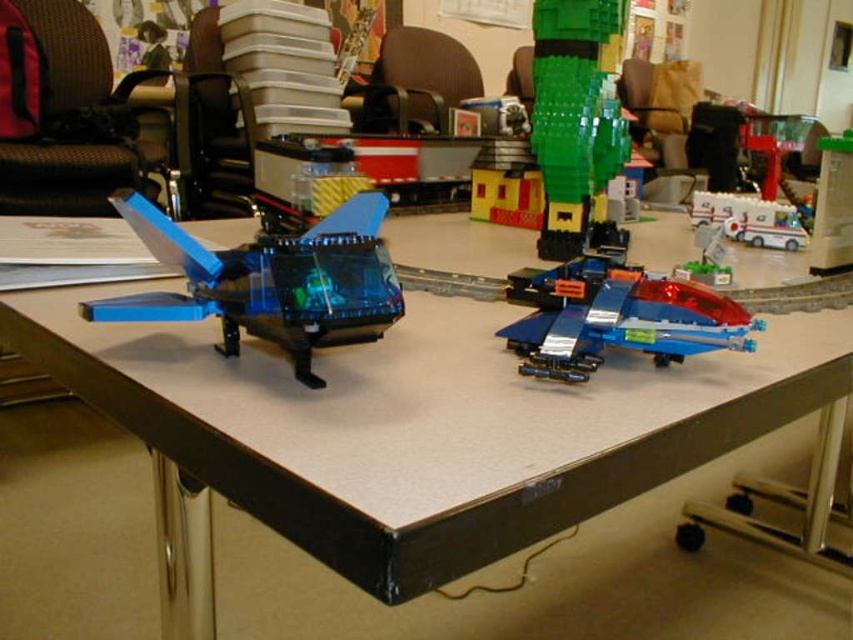
Consider the image. Does smooth gray table at center appear on the left side of translucent blue plastic spaceship at center?

Correct, you'll find smooth gray table at center to the left of translucent blue plastic spaceship at center.

Which of these two, smooth gray table at center or translucent blue plastic spaceship at center, stands taller?

With more height is smooth gray table at center.

Does point (622, 438) lie behind point (550, 352)?

No.

Locate an element on the screen. This screenshot has width=853, height=640. smooth gray table at center is located at coordinates (422, 424).

Between point (518, 344) and point (772, 241), which one is positioned in front?

Positioned in front is point (518, 344).

Is translucent blue plastic spaceship at center in front of white plastic ambulance at center-right?

Yes, translucent blue plastic spaceship at center is in front of white plastic ambulance at center-right.

Who is more distant from viewer, (558, 272) or (711, 212)?

Point (711, 212)

Locate an element on the screen. The width and height of the screenshot is (853, 640). translucent blue plastic spaceship at center is located at coordinates tap(616, 317).

Between transparent plastic spaceship at left and translucent blue plastic spaceship at center, which one has more height?

transparent plastic spaceship at left is taller.

Which is in front, point (215, 275) or point (579, 308)?

Point (215, 275) is more forward.

Which is behind, point (131, 209) or point (699, 292)?

The point (699, 292) is more distant.

Where is `transparent plastic spaceship at left`? transparent plastic spaceship at left is located at coordinates tap(271, 282).